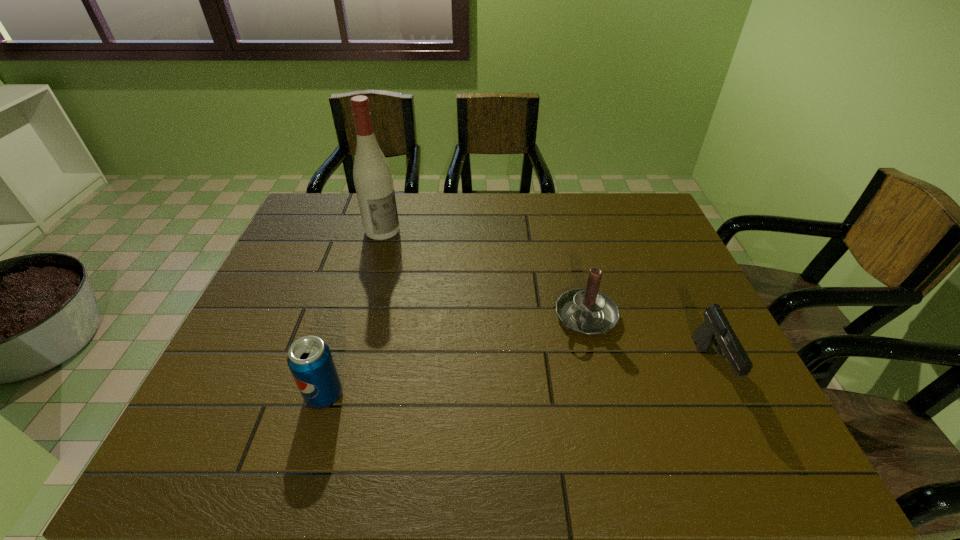
At what (x,y) coordinates should I click in order to perform the action: click on free space between the pop soda and the second object from right to left. Please return your answer as a coordinate pair (x, y). The height and width of the screenshot is (540, 960). Looking at the image, I should click on (455, 355).

Find the location of a particular element. free space between the farthest object and the shortest object is located at coordinates (546, 299).

Find the location of a particular element. Image resolution: width=960 pixels, height=540 pixels. unoccupied area between the pop soda and the tallest object is located at coordinates (353, 313).

I want to click on free space that is in between the candle and the shortest object, so click(x=649, y=341).

Where is `free space between the farthest object and the shortest object`? This screenshot has height=540, width=960. free space between the farthest object and the shortest object is located at coordinates (546, 299).

At what (x,y) coordinates should I click in order to perform the action: click on object that ranks as the closest to the second object from right to left. Please return your answer as a coordinate pair (x, y). Looking at the image, I should click on (716, 327).

Locate which object ranks third in proximity to the pop soda. Please provide its 2D coordinates. Your answer should be formatted as a tuple, i.e. [(x, y)], where the tuple contains the x and y coordinates of a point satisfying the conditions above.

[(716, 327)]

The width and height of the screenshot is (960, 540). I want to click on free space that satisfies the following two spatial constraints: 1. on the back side of the pop soda; 2. on the left side of the tallest object, so click(373, 231).

Find the location of a particular element. free space that satisfies the following two spatial constraints: 1. on the front side of the alcohol; 2. on the right side of the candle is located at coordinates (359, 316).

I want to click on free point that satisfies the following two spatial constraints: 1. on the front side of the third object from left to right; 2. on the right side of the tallest object, so click(359, 316).